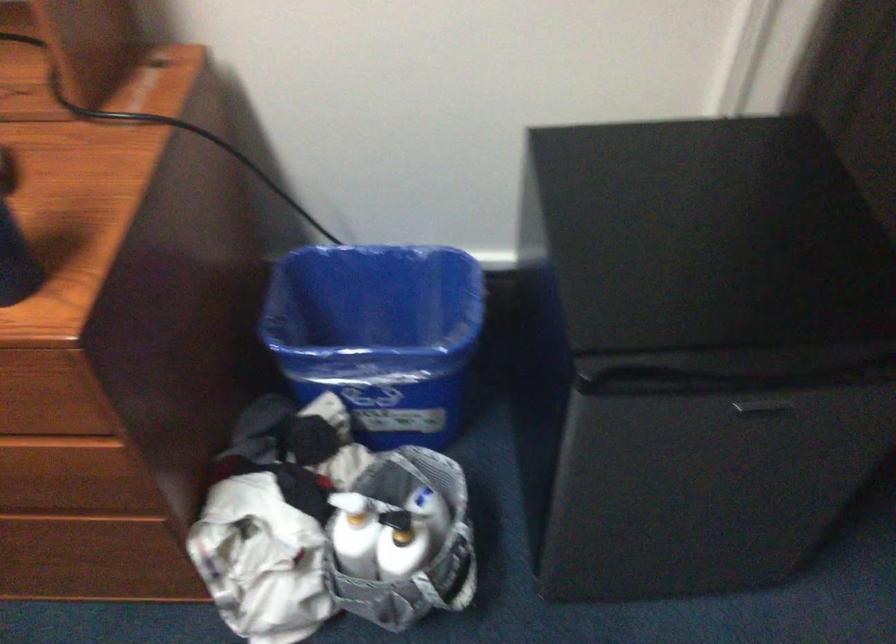
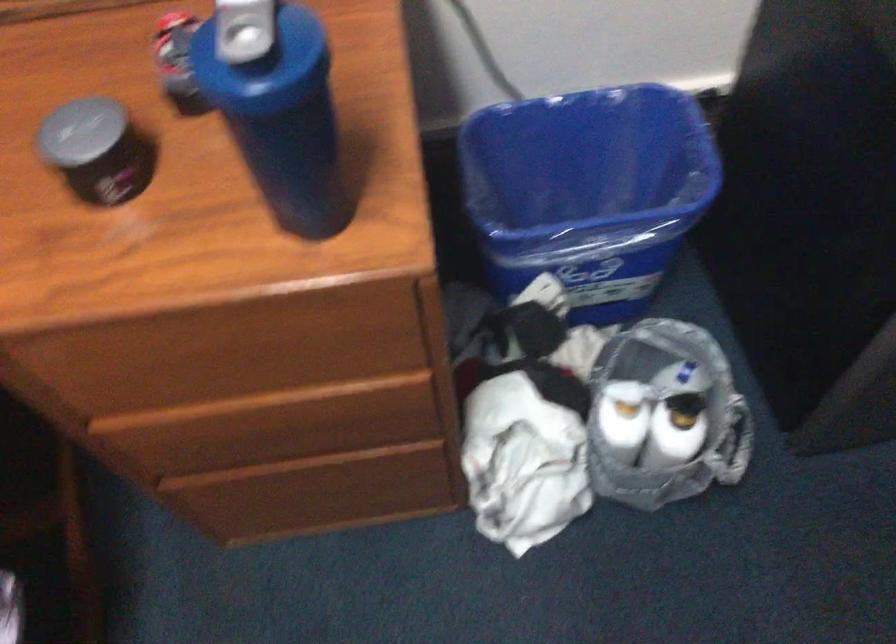
Locate, in the second image, the point that corresponds to the point at 352,529 in the first image.

(624, 418)